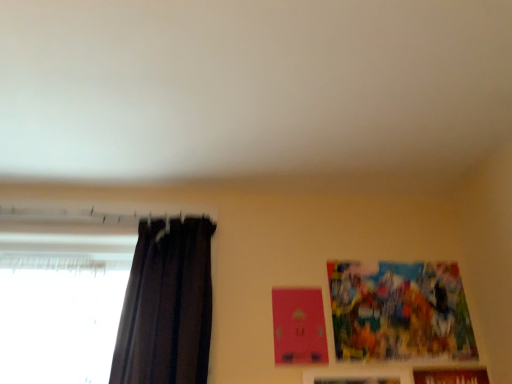
Question: From their relative heights in the image, would you say colorful paper picture frame at upper right, which is the 1th picture frame from top to bottom, is taller or shorter than brown wooden picture frame at lower right, the 1th picture frame ordered from the bottom?

Choices:
 (A) tall
 (B) short

Answer: (B)

Question: Visually, is colorful paper picture frame at upper right, which is the 1th picture frame from top to bottom, positioned to the left or to the right of brown wooden picture frame at lower right, the 1th picture frame ordered from the bottom?

Choices:
 (A) right
 (B) left

Answer: (B)

Question: Estimate the real-world distances between objects in this image. Which object is farther from the wooden picture frame at lower right, which ranks as the 2th picture frame in bottom-to-top order?

Choices:
 (A) colorful paper picture frame at upper right, which is the 1th picture frame from top to bottom
 (B) dark matte curtain at left
 (C) brown wooden picture frame at lower right, which is the third picture frame in top-to-bottom order

Answer: (B)

Question: Estimate the real-world distances between objects in this image. Which object is farther from the dark matte curtain at left?

Choices:
 (A) brown wooden picture frame at lower right, which is the third picture frame in top-to-bottom order
 (B) wooden picture frame at lower right, which ranks as the 2th picture frame in bottom-to-top order
 (C) colorful paper picture frame at upper right, the 3th picture frame ordered from the bottom

Answer: (A)